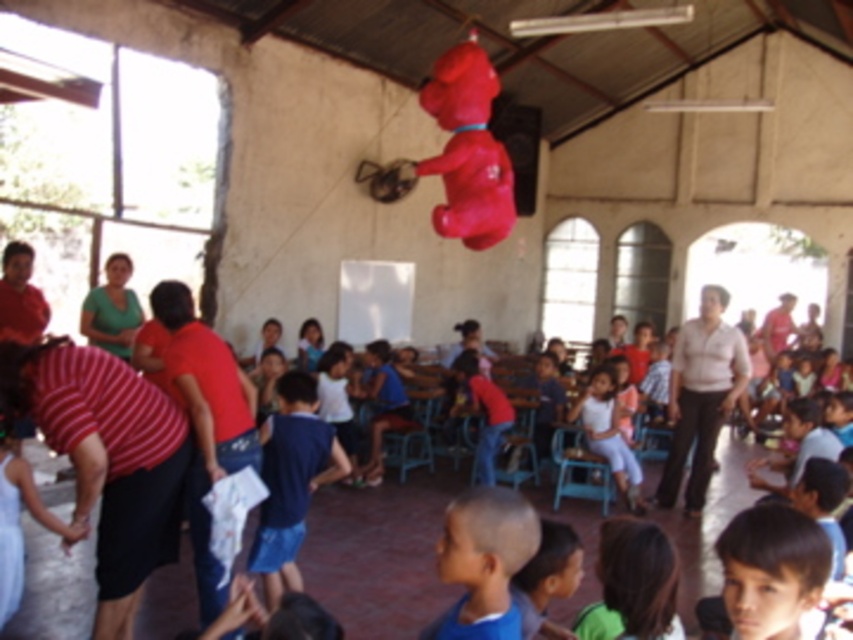
You are standing at the entrance of the gathering and see a bright red pi?ata shaped like a bear in the center of the room. There is also a point marked at coordinates (19, 524). What object is this point located on?

The point at coordinates (19, 524) is located on the white cotton dress at lower left.

You are a photographer standing at the entrance of the room. You want to take a picture of the bright red pi?ata shaped like a bear and the rubber dog at upper center. Where should you position yourself to include both in the frame?

To include both the bright red pi?ata shaped like a bear and the rubber dog at upper center in the frame, position yourself at the entrance and aim your camera towards the center of the room where the pi?ata hangs. The rubber dog at upper center is located at coordinates point (467, 148), so adjusting the camera angle slightly upward or to the left may help capture both subjects within the same shot.